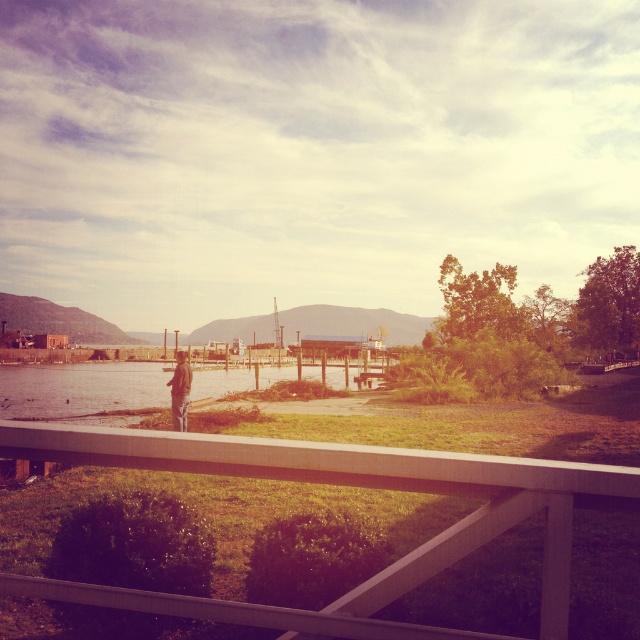
Question: Can you confirm if smooth concrete lake at center is bigger than brown leather jacket at lower center?

Choices:
 (A) no
 (B) yes

Answer: (B)

Question: Which of the following is the farthest from the observer?

Choices:
 (A) brown leather jacket at lower center
 (B) white matte rail at center

Answer: (A)

Question: Does white matte rail at center have a smaller size compared to brown leather jacket at lower center?

Choices:
 (A) no
 (B) yes

Answer: (B)

Question: Which object is closer to the camera taking this photo?

Choices:
 (A) white matte rail at center
 (B) smooth concrete lake at center

Answer: (A)

Question: Which point is closer to the camera?

Choices:
 (A) (80, 456)
 (B) (33, 387)

Answer: (A)

Question: In this image, where is smooth concrete lake at center located relative to brown leather jacket at lower center?

Choices:
 (A) right
 (B) left

Answer: (B)